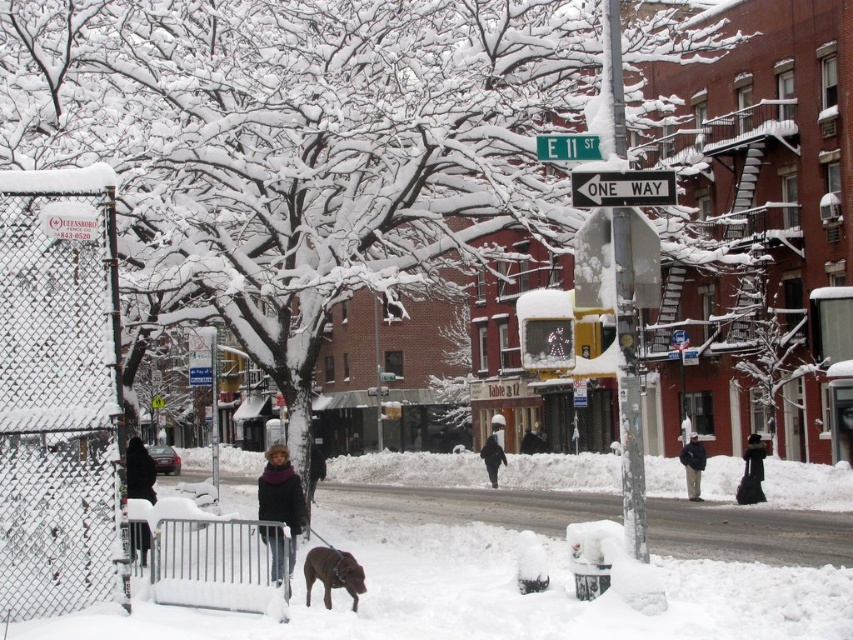
You are navigating a snowy street and see the black plastic one way sign at center and the green metallic street sign at upper center. Which of these two signs is positioned to the right side of the other?

The black plastic one way sign at center is positioned to the right of the green metallic street sign at upper center.